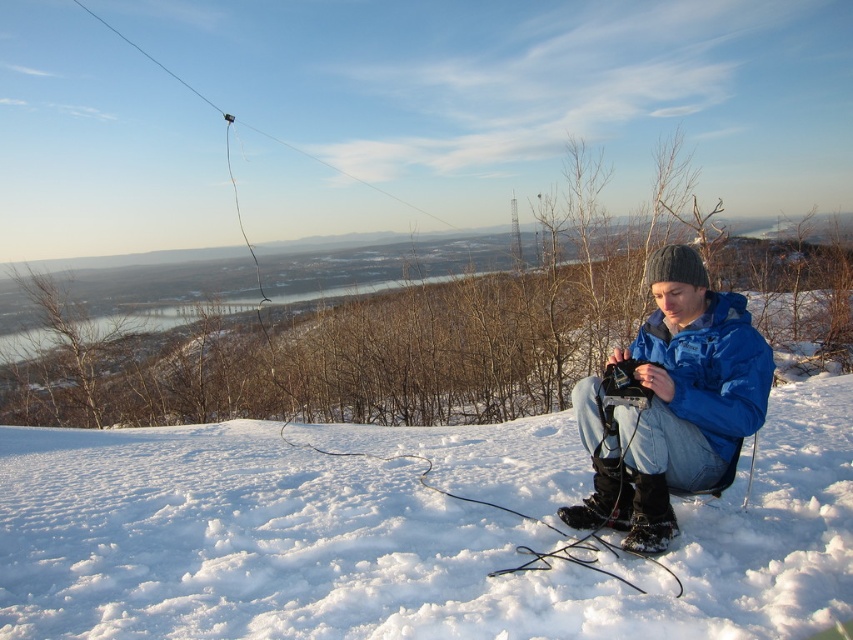
You are a photographer trying to capture both the blue matte jacket at center and the blue synthetic jacket at center in a single frame. Given that your camera has a minimum focus distance of 6 inches, can you clearly focus on both jackets?

The blue matte jacket at center is 6.85 inches away from the blue synthetic jacket at center. Since the minimum focus distance is 6 inches, the jackets are within the camera range, so both can be clearly focused in the photo.

You are navigating a drone through the winter scene. The drone must fly from the point at coordinates (502, 577) to the point at (733, 365). Will the drone have to pass over any obstacles between these two points?

The point at coordinates (502, 577) is in front of the point at (733, 365), so the drone will not need to pass over any obstacles between them.